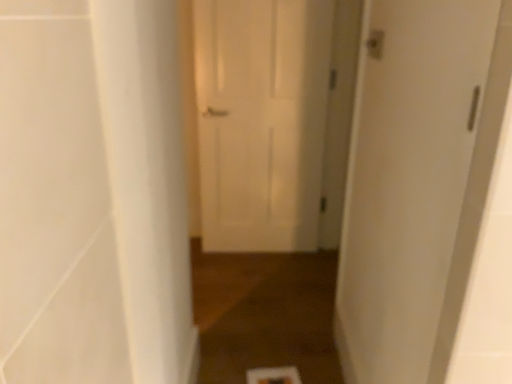
Identify the location of white smooth pillar at left. (147, 182).

What do you see at coordinates (265, 314) in the screenshot? The width and height of the screenshot is (512, 384). I see `brown wood floor at center` at bounding box center [265, 314].

Locate an element on the screen. white smooth pillar at left is located at coordinates (147, 182).

Is white smooth pillar at left located within white matte door at center, placed as the 1th door when sorted from back to front?

No, white smooth pillar at left is not inside white matte door at center, placed as the 1th door when sorted from back to front.

Which object is further away from the camera taking this photo, white matte door at center, acting as the second door starting from the front, or white smooth pillar at left?

white matte door at center, acting as the second door starting from the front.

Is white matte door at center, the second door from the right, turned away from white smooth pillar at left?

No, white matte door at center, the second door from the right, is not facing the opposite direction of white smooth pillar at left.

From a real-world perspective, is white matte door at center, the second door from the right, under white smooth pillar at left?

Correct, in the physical world, white matte door at center, the second door from the right, is lower than white smooth pillar at left.

Is brown wood floor at center bigger or smaller than white matte door at right, arranged as the second door when viewed from the left?

In the image, brown wood floor at center appears to be larger than white matte door at right, arranged as the second door when viewed from the left.

Looking at this image, is white matte door at right, which ranks as the first door in front-to-back order, inside brown wood floor at center?

No, white matte door at right, which ranks as the first door in front-to-back order, is not inside brown wood floor at center.

Is point (307, 349) more distant than point (369, 337)?

Yes, it is behind point (369, 337).

From the picture: Between brown wood floor at center and white matte door at right, marked as the 2th door in a back-to-front arrangement, which one has smaller width?

Thinner between the two is white matte door at right, marked as the 2th door in a back-to-front arrangement.

Could you tell me if brown wood floor at center is turned towards white matte door at center, the second door from the right?

No.

Does brown wood floor at center come behind white matte door at center, acting as the second door starting from the front?

No.

From the picture: From a real-world perspective, is brown wood floor at center physically above white matte door at center, the first door in the left-to-right sequence?

No, from a real-world perspective, brown wood floor at center is not over white matte door at center, the first door in the left-to-right sequence

From the image's perspective, which one is positioned lower, brown wood floor at center or white matte door at center, acting as the second door starting from the front?

brown wood floor at center is shown below in the image.

From a real-world perspective, is brown wood floor at center physically located above or below white smooth pillar at left?

brown wood floor at center is below white smooth pillar at left.

Which of these two, brown wood floor at center or white smooth pillar at left, is wider?

Wider between the two is brown wood floor at center.

From the picture: Who is shorter, brown wood floor at center or white smooth pillar at left?

Standing shorter between the two is brown wood floor at center.

Locate an element on the screen. Image resolution: width=512 pixels, height=384 pixels. path lying in front of the white matte door at center, the first door in the left-to-right sequence is located at coordinates (265, 314).

Is white matte door at center, the second door from the right, not inside brown wood floor at center?

Yes, white matte door at center, the second door from the right, is located beyond the bounds of brown wood floor at center.

Which object is wider, white matte door at center, the second door from the right, or brown wood floor at center?

With larger width is brown wood floor at center.

Which object is closer to the camera, white matte door at center, placed as the 1th door when sorted from back to front, or brown wood floor at center?

brown wood floor at center.

Looking at this image, is white smooth pillar at left inside the boundaries of white matte door at center, acting as the second door starting from the front, or outside?

white smooth pillar at left is located beyond the bounds of white matte door at center, acting as the second door starting from the front.

Based on the photo, is white smooth pillar at left taller than white matte door at center, placed as the 1th door when sorted from back to front?

Incorrect, the height of white smooth pillar at left is not larger of that of white matte door at center, placed as the 1th door when sorted from back to front.

Relative to white matte door at center, placed as the 1th door when sorted from back to front, is white smooth pillar at left in front or behind?

white smooth pillar at left is positioned closer to the viewer than white matte door at center, placed as the 1th door when sorted from back to front.

What's the angular difference between white smooth pillar at left and white matte door at center, the first door in the left-to-right sequence,'s facing directions?

They differ by 84.1 degrees in their facing directions.

From a real-world perspective, who is located higher, white smooth pillar at left or brown wood floor at center?

In real-world perspective, white smooth pillar at left is above.

Based on the photo, who is smaller, white smooth pillar at left or brown wood floor at center?

With smaller size is white smooth pillar at left.

Considering the sizes of objects white smooth pillar at left and brown wood floor at center in the image provided, who is wider, white smooth pillar at left or brown wood floor at center?

Wider between the two is brown wood floor at center.

Which is closer, (143,271) or (230,272)?

Clearly, point (143,271) is closer to the camera than point (230,272).

Where is `the 2nd door above when counting from the white smooth pillar at left (from the image's perspective)`? the 2nd door above when counting from the white smooth pillar at left (from the image's perspective) is located at coordinates (261, 121).

Where is `path lying behind the white matte door at right, which ranks as the first door in front-to-back order`? path lying behind the white matte door at right, which ranks as the first door in front-to-back order is located at coordinates [x=265, y=314].

Looking at the image, which one is located further to white matte door at right, marked as the 2th door in a back-to-front arrangement, white matte door at center, the first door in the left-to-right sequence, or brown wood floor at center?

white matte door at center, the first door in the left-to-right sequence.

Considering their positions, is white matte door at right, arranged as the first door when viewed from the right, positioned further to white matte door at center, placed as the 1th door when sorted from back to front, than brown wood floor at center?

Result: white matte door at right, arranged as the first door when viewed from the right.

Which object lies further to the anchor point brown wood floor at center, white matte door at center, the first door in the left-to-right sequence, or white matte door at right, marked as the 2th door in a back-to-front arrangement?

Based on the image, white matte door at right, marked as the 2th door in a back-to-front arrangement, appears to be further to brown wood floor at center.

Estimate the real-world distances between objects in this image. Which object is further from white matte door at center, acting as the second door starting from the front, brown wood floor at center or white smooth pillar at left?

white smooth pillar at left is further to white matte door at center, acting as the second door starting from the front.

Which object lies further to the anchor point brown wood floor at center, white matte door at center, the second door from the right, or white smooth pillar at left?

The object further to brown wood floor at center is white matte door at center, the second door from the right.

When comparing their distances from white matte door at right, arranged as the second door when viewed from the left, does brown wood floor at center or white smooth pillar at left seem further?

Among the two, brown wood floor at center is located further to white matte door at right, arranged as the second door when viewed from the left.

Based on their spatial positions, is white smooth pillar at left or white matte door at right, marked as the 2th door in a back-to-front arrangement, closer to white matte door at center, acting as the second door starting from the front?

Among the two, white smooth pillar at left is located nearer to white matte door at center, acting as the second door starting from the front.

Estimate the real-world distances between objects in this image. Which object is closer to white smooth pillar at left, white matte door at center, the first door in the left-to-right sequence, or white matte door at right, arranged as the first door when viewed from the right?

white matte door at right, arranged as the first door when viewed from the right, is closer to white smooth pillar at left.

Find the location of a particular element. door between white smooth pillar at left and brown wood floor at center in the front-back direction is located at coordinates (416, 182).

Image resolution: width=512 pixels, height=384 pixels. I want to click on path between white matte door at right, marked as the 2th door in a back-to-front arrangement, and white matte door at center, the second door from the right, along the z-axis, so click(265, 314).

Image resolution: width=512 pixels, height=384 pixels. Identify the location of door located between white smooth pillar at left and white matte door at center, placed as the 1th door when sorted from back to front, in the depth direction. (416, 182).

What are the coordinates of `path positioned between white smooth pillar at left and white matte door at center, acting as the second door starting from the front, from near to far` in the screenshot? It's located at (265, 314).